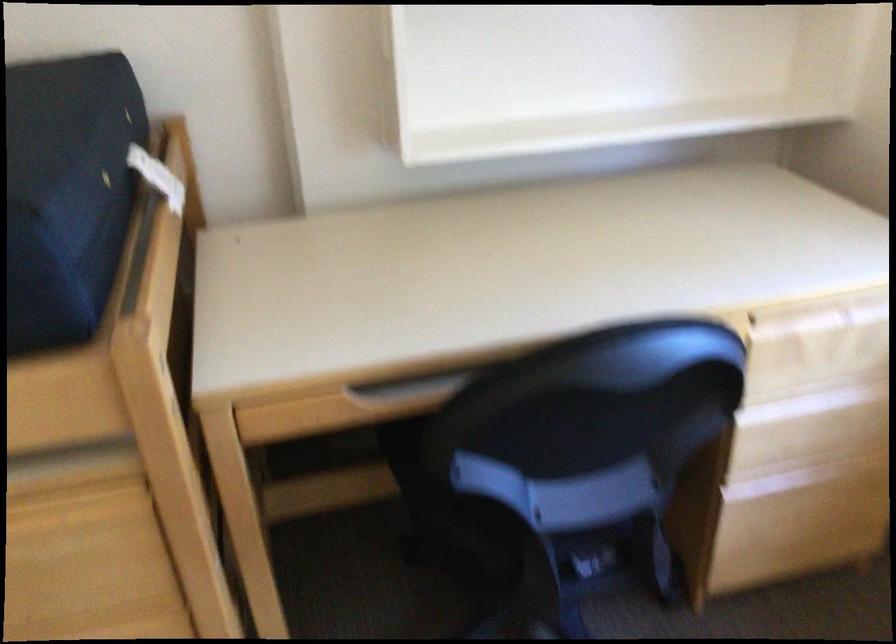
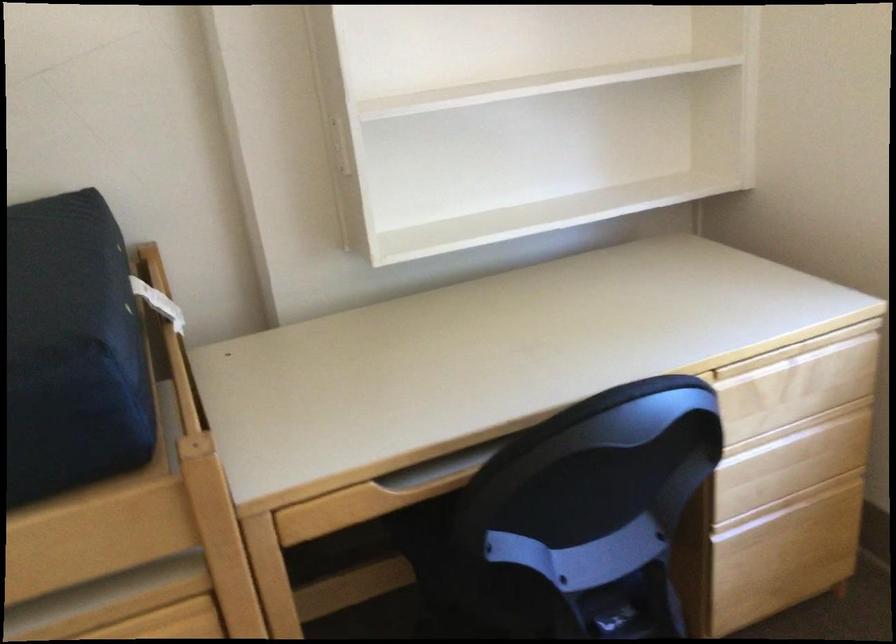
Which direction would the cameraman need to move to produce the second image?

The movement direction of the cameraman is left, backward.